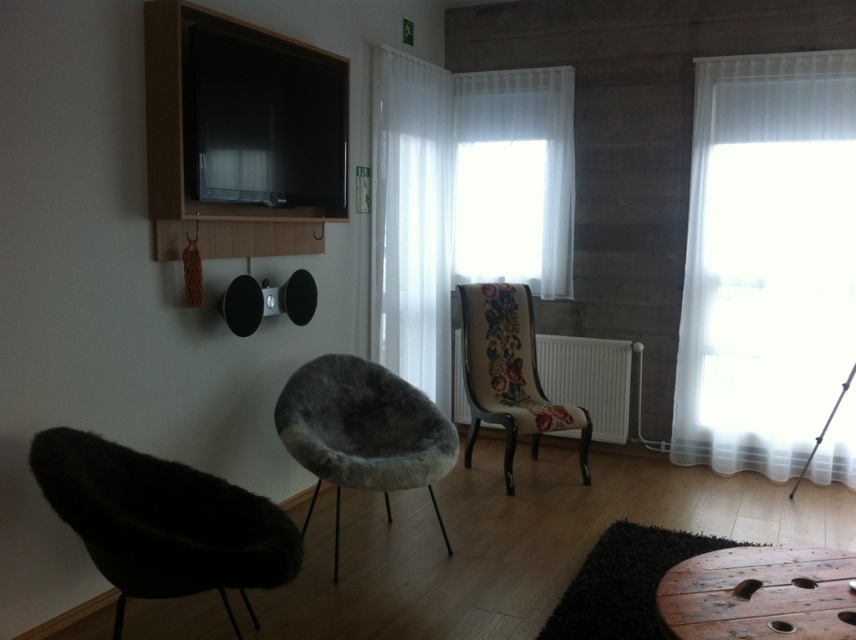
Does white sheer curtain at right have a greater width compared to white sheer curtain at center?

Incorrect, white sheer curtain at right's width does not surpass white sheer curtain at center's.

Does white sheer curtain at right appear on the right side of white sheer curtain at center?

Yes, white sheer curtain at right is to the right of white sheer curtain at center.

The image size is (856, 640). Describe the element at coordinates (765, 260) in the screenshot. I see `white sheer curtain at right` at that location.

The width and height of the screenshot is (856, 640). What are the coordinates of `white sheer curtain at right` in the screenshot? It's located at (765, 260).

Between white sheer curtain at center and wooden table at lower right, which one has more height?

Standing taller between the two is white sheer curtain at center.

Is white sheer curtain at center wider than wooden table at lower right?

Yes.

Between point (444, 332) and point (846, 624), which one is positioned behind?

The point (444, 332) is behind.

Where is `white sheer curtain at center`? Image resolution: width=856 pixels, height=640 pixels. white sheer curtain at center is located at coordinates (462, 200).

Between dark brown fur armchair at lower left and wooden table at lower right, which one is positioned lower?

wooden table at lower right

Which of these two, dark brown fur armchair at lower left or wooden table at lower right, stands shorter?

wooden table at lower right

You are a GUI agent. You are given a task and a screenshot of the screen. Output one action in this format:
    pyautogui.click(x=<x>, y=<y>)
    Task: Click on the dark brown fur armchair at lower left
    
    Given the screenshot: What is the action you would take?
    pyautogui.click(x=162, y=522)